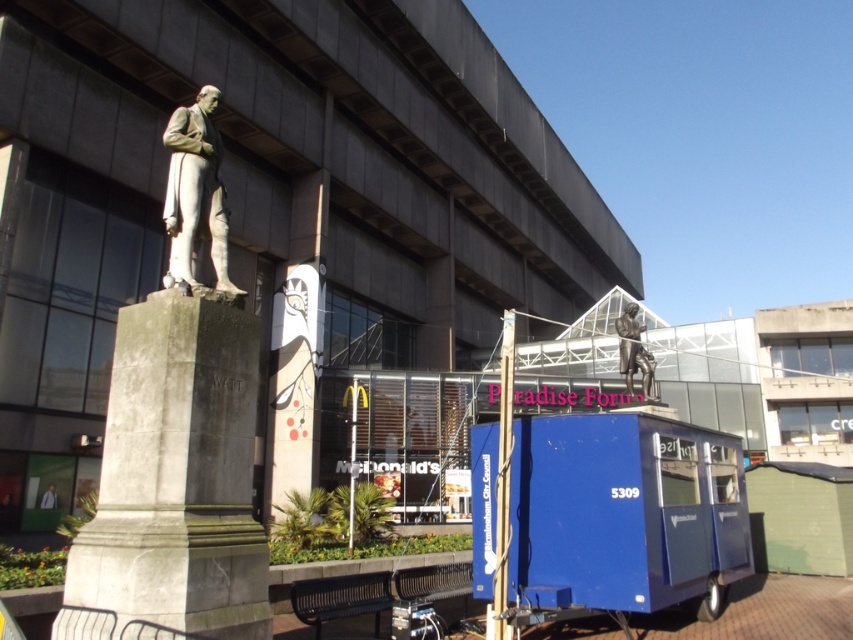
Which of these two, polished bronze statue at left or light brown leather jacket at lower left, stands taller?

Standing taller between the two is polished bronze statue at left.

Describe the element at coordinates (195, 195) in the screenshot. I see `polished bronze statue at left` at that location.

What do you see at coordinates (195, 195) in the screenshot? I see `polished bronze statue at left` at bounding box center [195, 195].

Image resolution: width=853 pixels, height=640 pixels. In order to click on polished bronze statue at left in this screenshot , I will do click(x=195, y=195).

This screenshot has height=640, width=853. What do you see at coordinates (177, 476) in the screenshot? I see `gray stone monument at left` at bounding box center [177, 476].

Based on the photo, who is lower down, gray stone monument at left or polished bronze statue at left?

Positioned lower is gray stone monument at left.

Between point (169, 605) and point (207, 147), which one is positioned in front?

Point (169, 605) is in front.

Image resolution: width=853 pixels, height=640 pixels. Identify the location of gray stone monument at left. (177, 476).

Who is more forward, (630, 394) or (42, 502)?

Positioned in front is point (42, 502).

Is polished bronze statue at upper center further to the viewer compared to light brown leather jacket at lower left?

No, it is in front of light brown leather jacket at lower left.

Between point (630, 356) and point (44, 508), which one is positioned in front?

Point (630, 356) is more forward.

Find the location of `polished bronze statue at upper center`. polished bronze statue at upper center is located at coordinates (633, 349).